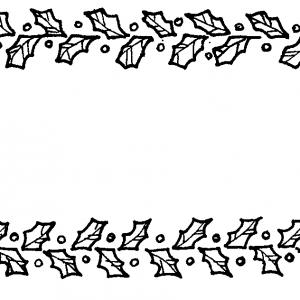
What are the coordinates of `middle area between two panels` in the screenshot? It's located at (72, 111), (187, 135), (74, 169), (223, 179).